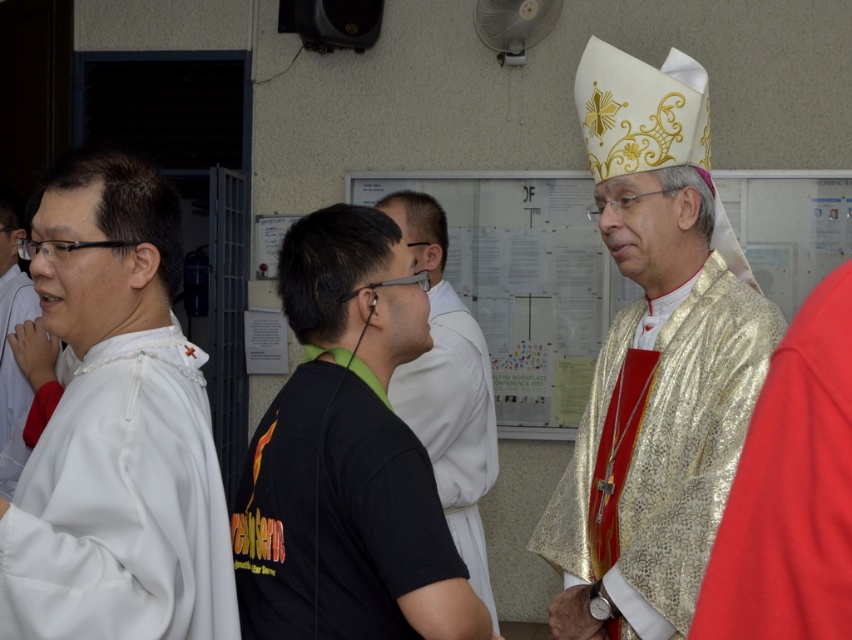
Question: Which point appears closest to the camera in this image?

Choices:
 (A) (654, 413)
 (B) (343, 436)
 (C) (170, 218)
 (D) (468, 346)

Answer: (B)

Question: Among these objects, which one is nearest to the camera?

Choices:
 (A) white matte shirt at left
 (B) gold shiny robe at right
 (C) white matte robe at left

Answer: (C)

Question: Is black matte t-shirt at center above white matte shirt at left?

Choices:
 (A) yes
 (B) no

Answer: (B)

Question: Does white matte robe at left have a greater width compared to black matte t-shirt at center?

Choices:
 (A) yes
 (B) no

Answer: (B)

Question: Does black matte t-shirt at center lie in front of black matte shirt at center?

Choices:
 (A) no
 (B) yes

Answer: (B)

Question: Considering the real-world distances, which object is closest to the black matte t-shirt at center?

Choices:
 (A) white matte robe at left
 (B) black matte shirt at center

Answer: (A)